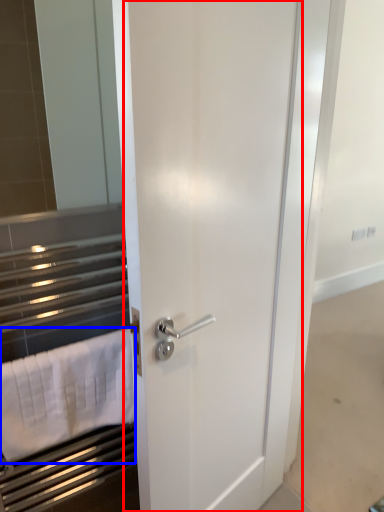
Question: Which object is further to the camera taking this photo, door (highlighted by a red box) or bath towel (highlighted by a blue box)?

Choices:
 (A) door
 (B) bath towel

Answer: (B)